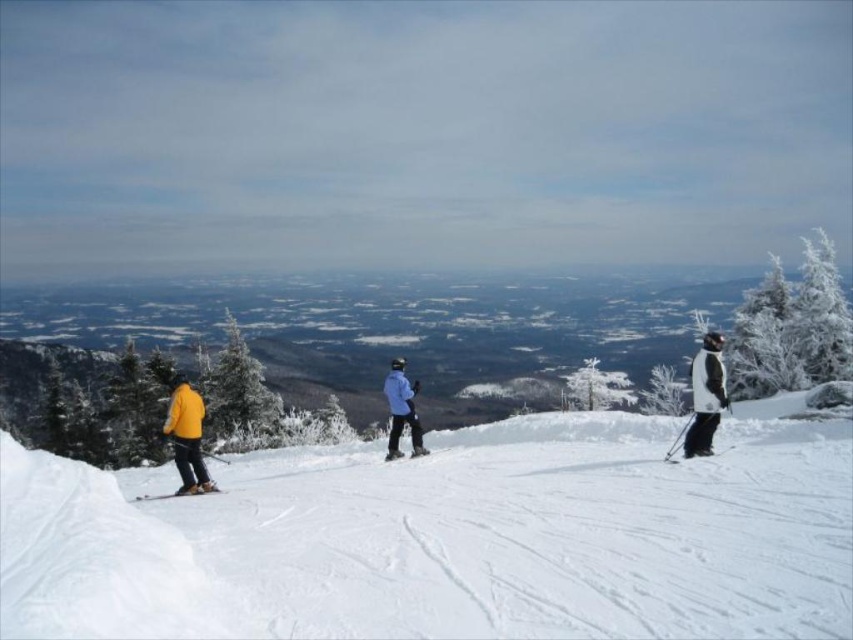
You are a ski instructor observing the scene. You notice the white powdery snow at center and the matte black ski at center. Which object is positioned higher in the image?

The white powdery snow at center is above the matte black ski at center, so it is positioned higher in the image.

You are a photographer trying to capture a clear shot of the white matte jacket at right and the matte black ski at center. Since you want to focus on the larger object, which one should you adjust your camera settings for?

The white matte jacket at right is bigger than the matte black ski at center, so you should adjust your camera settings to focus on the white matte jacket at right.

You are a photographer standing at the base of the slope. You want to capture a photo that includes both the light blue fabric jacket at center and the matte black ski at lower left. Which object will appear higher in the photo?

The light blue fabric jacket at center will appear higher in the photo because it is positioned above the matte black ski at lower left.